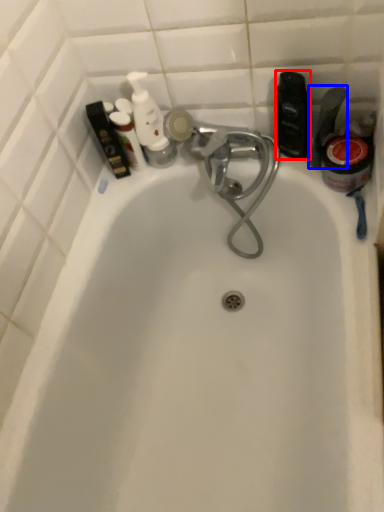
Question: Which object is further to the camera taking this photo, toiletry (highlighted by a red box) or toiletry (highlighted by a blue box)?

Choices:
 (A) toiletry
 (B) toiletry

Answer: (A)